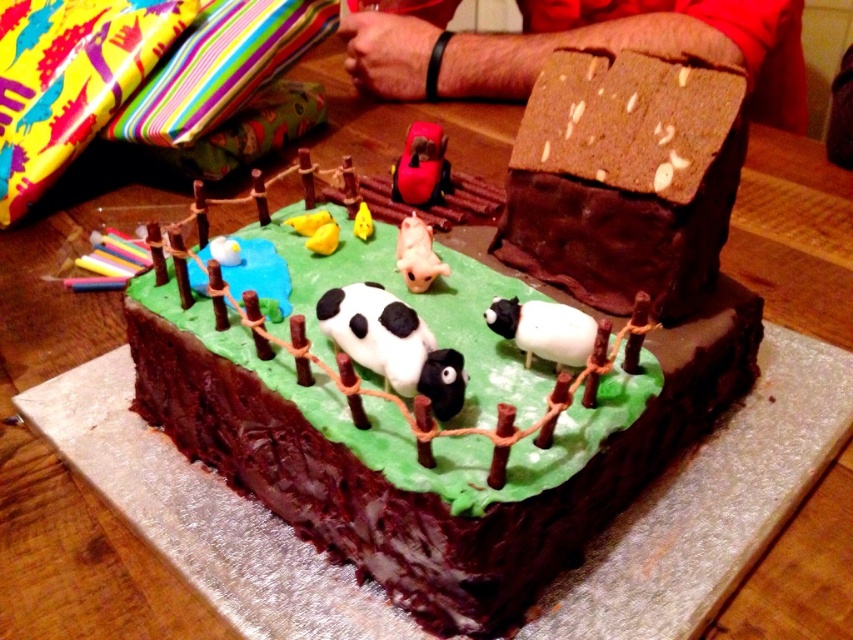
Question: Among these points, which one is farthest from the camera?

Choices:
 (A) (531, 314)
 (B) (602, 451)

Answer: (A)

Question: Which object is farther from the camera taking this photo?

Choices:
 (A) black matte cow at center
 (B) white matte sheep at center

Answer: (B)

Question: Can you confirm if black matte cow at center is smaller than white matte sheep at center?

Choices:
 (A) no
 (B) yes

Answer: (A)

Question: Which point is closer to the camera taking this photo?

Choices:
 (A) (602, 186)
 (B) (422, 348)

Answer: (B)

Question: Does chocolatealmondhouse at upper center have a larger size compared to white matte sheep at center?

Choices:
 (A) no
 (B) yes

Answer: (B)

Question: Can you confirm if chocolate cake at center is wider than black matte cow at center?

Choices:
 (A) yes
 (B) no

Answer: (A)